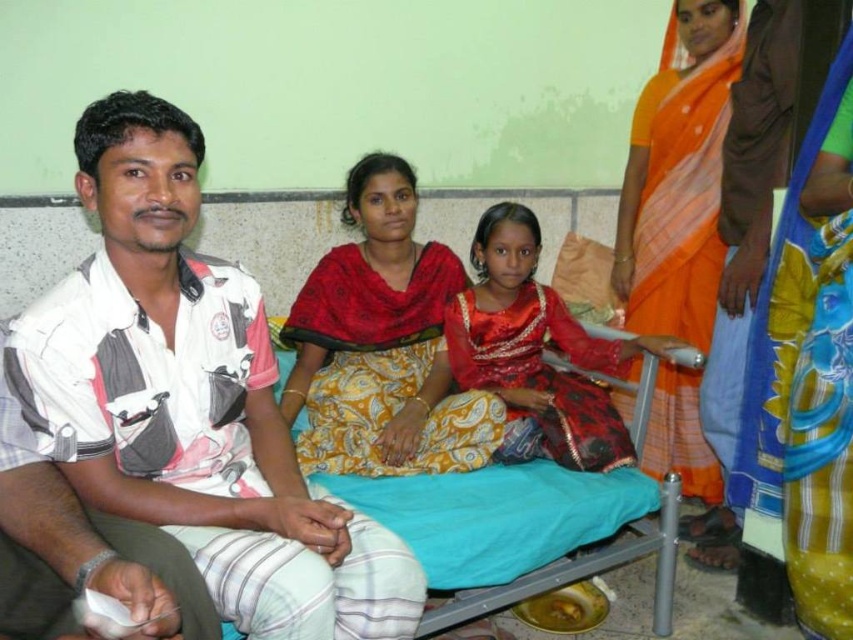
You are taking a photo of the scene and want to focus on both point A at point [479,456] and point B at point [666,371]. Which point should you adjust your focus to first to ensure both are in sharp view?

Point A at point [479,456] should be focused on first since it is closer to the camera than point B at point [666,371]. Adjusting focus starting from the closer point ensures both points can be in focus.

You are standing in the room and want to pick up an item from the floor. You see two points marked on the floor at coordinates point (x=670, y=461) and point (x=505, y=275). Which point is closer to you?

Point (x=670, y=461) is further to the viewer than point (x=505, y=275), so the closer point to you is point (x=505, y=275).